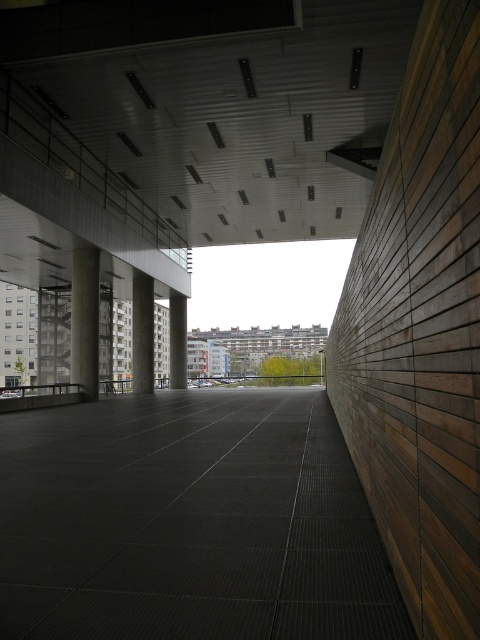
Question: Which of these objects is positioned farthest from the wooden plank at right?

Choices:
 (A) concrete column at center
 (B) concrete pillar at center
 (C) matte gray concrete pillar at center

Answer: (C)

Question: Among these points, which one is nearest to the camera?

Choices:
 (A) tap(137, 355)
 (B) tap(170, 336)

Answer: (A)

Question: In this image, where is wooden plank at right located relative to matte gray concrete pillar at center?

Choices:
 (A) below
 (B) above

Answer: (B)

Question: Which point appears closest to the camera in this image?

Choices:
 (A) (139, 352)
 (B) (478, 593)

Answer: (B)

Question: Is the position of dark gray concrete corridor at center more distant than that of wooden plank at right?

Choices:
 (A) no
 (B) yes

Answer: (B)

Question: Is dark gray concrete corridor at center in front of concrete column at center?

Choices:
 (A) no
 (B) yes

Answer: (B)